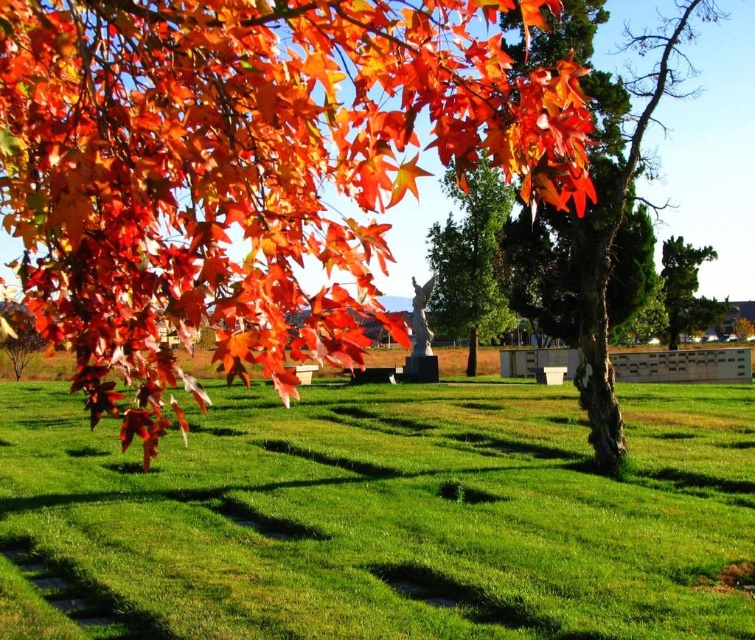
Can you confirm if shiny orange leaves at upper left is positioned below smooth green tree at center?

Correct, shiny orange leaves at upper left is located below smooth green tree at center.

Is shiny orange leaves at upper left to the right of smooth green tree at center from the viewer's perspective?

No, shiny orange leaves at upper left is not to the right of smooth green tree at center.

Which is in front, point (404, 154) or point (439, 259)?

Point (404, 154) is more forward.

Where is `shiny orange leaves at upper left`? shiny orange leaves at upper left is located at coordinates (247, 160).

Can you confirm if shiny orange leaves at upper left is wider than green textured tree at center-right?

No, shiny orange leaves at upper left is not wider than green textured tree at center-right.

Who is more forward, (236, 342) or (680, 273)?

Point (236, 342) is more forward.

You are a GUI agent. You are given a task and a screenshot of the screen. Output one action in this format:
    pyautogui.click(x=<x>, y=<y>)
    Task: Click on the shiny orange leaves at upper left
    
    Given the screenshot: What is the action you would take?
    pyautogui.click(x=247, y=160)

Can you confirm if shiny orange leaves at upper left is positioned to the right of brown rough bark tree at center?

In fact, shiny orange leaves at upper left is to the left of brown rough bark tree at center.

Does shiny orange leaves at upper left have a lesser width compared to brown rough bark tree at center?

Correct, shiny orange leaves at upper left's width is less than brown rough bark tree at center's.

Who is more distant from viewer, [313,172] or [609,262]?

The point [609,262] is more distant.

The height and width of the screenshot is (640, 755). What are the coordinates of `shiny orange leaves at upper left` in the screenshot? It's located at (247, 160).